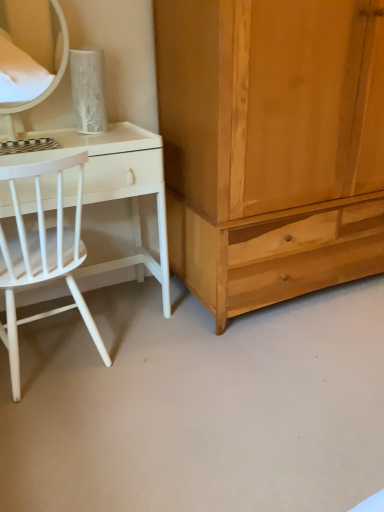
Question: Is light brown wood cabinet at right looking in the opposite direction of white matte wood chair at left?

Choices:
 (A) no
 (B) yes

Answer: (A)

Question: Is white matte wood chair at left a part of light brown wood cabinet at right?

Choices:
 (A) no
 (B) yes

Answer: (A)

Question: Is light brown wood cabinet at right in front of white matte wood chair at left?

Choices:
 (A) no
 (B) yes

Answer: (A)

Question: Considering the relative positions of light brown wood cabinet at right and white matte wood chair at left in the image provided, is light brown wood cabinet at right to the right of white matte wood chair at left from the viewer's perspective?

Choices:
 (A) no
 (B) yes

Answer: (B)

Question: Is light brown wood cabinet at right to the left of white matte wood chair at left from the viewer's perspective?

Choices:
 (A) no
 (B) yes

Answer: (A)

Question: From a real-world perspective, is light brown wood cabinet at right located higher than white matte wood chair at left?

Choices:
 (A) yes
 (B) no

Answer: (A)

Question: Are white matte wood chair at left and white glossy desk at left located far from each other?

Choices:
 (A) no
 (B) yes

Answer: (A)

Question: Does white matte wood chair at left have a lesser height compared to white glossy desk at left?

Choices:
 (A) yes
 (B) no

Answer: (B)

Question: Is white matte wood chair at left next to white glossy desk at left and touching it?

Choices:
 (A) no
 (B) yes

Answer: (A)

Question: Is white glossy desk at left located within white matte wood chair at left?

Choices:
 (A) no
 (B) yes

Answer: (B)

Question: From the image's perspective, is white matte wood chair at left on white glossy desk at left?

Choices:
 (A) yes
 (B) no

Answer: (B)

Question: Does white matte wood chair at left lie behind white glossy desk at left?

Choices:
 (A) no
 (B) yes

Answer: (A)

Question: Does white glossy desk at left have a lesser height compared to light brown wood cabinet at right?

Choices:
 (A) yes
 (B) no

Answer: (A)